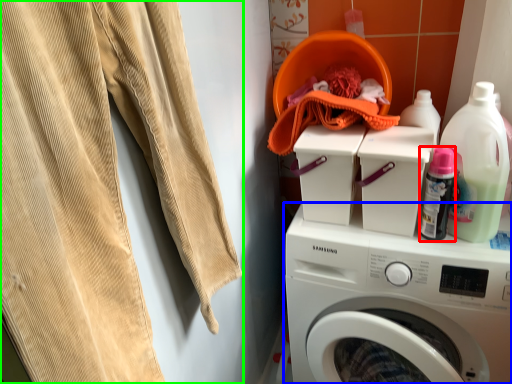
Question: Which is farther away from bottle (highlighted by a red box)? washing machine (highlighted by a blue box) or sweat pant (highlighted by a green box)?

Choices:
 (A) washing machine
 (B) sweat pant

Answer: (B)